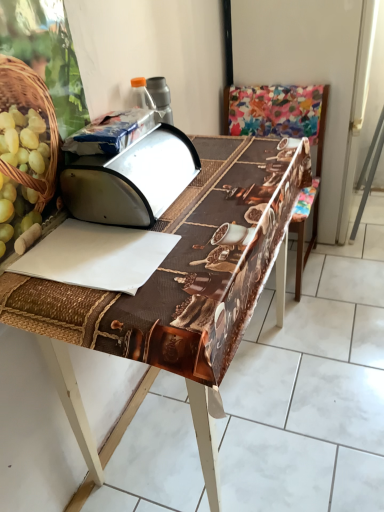
The image size is (384, 512). I want to click on metallic silver breadbox at center, so click(131, 180).

The height and width of the screenshot is (512, 384). What do you see at coordinates (131, 180) in the screenshot?
I see `metallic silver breadbox at center` at bounding box center [131, 180].

Describe the element at coordinates (111, 133) in the screenshot. I see `blue plastic bag at upper center, positioned as the 2th wrapping paper in bottom-to-top order` at that location.

Measure the distance between point (78,145) and camera.

38.39 inches.

The height and width of the screenshot is (512, 384). Describe the element at coordinates (303, 238) in the screenshot. I see `multicolored fabric chair at center` at that location.

Where is `brown woven table at center`? Image resolution: width=384 pixels, height=512 pixels. brown woven table at center is located at coordinates (x=175, y=290).

Where is `metallic silver breadbox at center`? metallic silver breadbox at center is located at coordinates (131, 180).

Is white paper at center, which ranks as the second wrapping paper in top-to-bottom order, shorter than metallic silver breadbox at center?

Indeed, white paper at center, which ranks as the second wrapping paper in top-to-bottom order, has a lesser height compared to metallic silver breadbox at center.

Can you confirm if white paper at center, which ranks as the second wrapping paper in top-to-bottom order, is smaller than metallic silver breadbox at center?

Yes, white paper at center, which ranks as the second wrapping paper in top-to-bottom order, is smaller than metallic silver breadbox at center.

How many degrees apart are the facing directions of white paper at center, the first wrapping paper in the bottom-to-top sequence, and metallic silver breadbox at center?

The angle between the facing direction of white paper at center, the first wrapping paper in the bottom-to-top sequence, and the facing direction of metallic silver breadbox at center is 0.00106 degrees.

Which object is further away from the camera taking this photo, white paper at center, the first wrapping paper in the bottom-to-top sequence, or metallic silver breadbox at center?

Positioned behind is metallic silver breadbox at center.

From the image's perspective, which object appears higher, multicolored fabric chair at center or white paper at center, which ranks as the second wrapping paper in top-to-bottom order?

multicolored fabric chair at center.

Does multicolored fabric chair at center touch white paper at center, which ranks as the second wrapping paper in top-to-bottom order?

multicolored fabric chair at center and white paper at center, which ranks as the second wrapping paper in top-to-bottom order, are clearly separated.

This screenshot has width=384, height=512. I want to click on the 2nd wrapping paper in front when counting from the multicolored fabric chair at center, so click(x=96, y=256).

Considering their positions, is multicolored fabric chair at center located in front of or behind white paper at center, the first wrapping paper in the bottom-to-top sequence?

multicolored fabric chair at center is behind white paper at center, the first wrapping paper in the bottom-to-top sequence.

Is point (138, 112) less distant than point (310, 241)?

That is True.

Is blue plastic bag at upper center, which is the 1th wrapping paper in top-to-bottom order, turned away from multicolored fabric chair at center?

No.

From the image's perspective, between blue plastic bag at upper center, positioned as the 2th wrapping paper in bottom-to-top order, and multicolored fabric chair at center, who is located below?

multicolored fabric chair at center is shown below in the image.

In the scene shown: Is metallic silver breadbox at center in front of blue plastic bag at upper center, positioned as the 2th wrapping paper in bottom-to-top order?

Yes, the depth of metallic silver breadbox at center is less than that of blue plastic bag at upper center, positioned as the 2th wrapping paper in bottom-to-top order.

The image size is (384, 512). I want to click on wide located on the right of blue plastic bag at upper center, positioned as the 2th wrapping paper in bottom-to-top order, so click(x=131, y=180).

Looking at the image, does metallic silver breadbox at center seem bigger or smaller compared to blue plastic bag at upper center, positioned as the 2th wrapping paper in bottom-to-top order?

In the image, metallic silver breadbox at center appears to be larger than blue plastic bag at upper center, positioned as the 2th wrapping paper in bottom-to-top order.

Which is correct: metallic silver breadbox at center is inside blue plastic bag at upper center, which is the 1th wrapping paper in top-to-bottom order, or outside of it?

metallic silver breadbox at center cannot be found inside blue plastic bag at upper center, which is the 1th wrapping paper in top-to-bottom order.

Between multicolored fabric chair at center and metallic silver breadbox at center, which one has smaller size?

metallic silver breadbox at center.

From the picture: Is multicolored fabric chair at center facing away from metallic silver breadbox at center?

That's not correct — multicolored fabric chair at center is not looking away from metallic silver breadbox at center.

How different are the orientations of multicolored fabric chair at center and metallic silver breadbox at center in degrees?

90 degrees.

From a real-world perspective, is multicolored fabric chair at center located higher than metallic silver breadbox at center?

No.

From the image's perspective, between brown woven table at center and white paper at center, the first wrapping paper in the bottom-to-top sequence, who is located below?

brown woven table at center, from the image's perspective.

Does brown woven table at center contain white paper at center, the first wrapping paper in the bottom-to-top sequence?

Yes, white paper at center, the first wrapping paper in the bottom-to-top sequence, is a part of brown woven table at center.

Could you tell me if brown woven table at center is turned towards white paper at center, the first wrapping paper in the bottom-to-top sequence?

No, brown woven table at center is not oriented towards white paper at center, the first wrapping paper in the bottom-to-top sequence.

Looking at this image, is the position of brown woven table at center less distant than that of white paper at center, the first wrapping paper in the bottom-to-top sequence?

Yes, it is.

Could multicolored fabric chair at center be considered to be inside brown woven table at center?

That's incorrect, multicolored fabric chair at center is not inside brown woven table at center.

Is brown woven table at center at the right side of multicolored fabric chair at center?

No.

From a real-world perspective, is brown woven table at center positioned above or below multicolored fabric chair at center?

Clearly, from a real-world perspective, brown woven table at center is below multicolored fabric chair at center.

The image size is (384, 512). I want to click on the 2nd wrapping paper to the left of the metallic silver breadbox at center, starting your count from the anchor, so click(96, 256).

This screenshot has width=384, height=512. In the image, there is a white paper at center, which ranks as the second wrapping paper in top-to-bottom order. In order to click on chair above it (from the image's perspective) in this screenshot , I will do `click(303, 238)`.

Estimate the real-world distances between objects in this image. Which object is closer to metallic silver breadbox at center, multicolored fabric chair at center or white paper at center, which ranks as the second wrapping paper in top-to-bottom order?

white paper at center, which ranks as the second wrapping paper in top-to-bottom order, is positioned closer to the anchor metallic silver breadbox at center.

Based on their spatial positions, is metallic silver breadbox at center or multicolored fabric chair at center closer to blue plastic bag at upper center, positioned as the 2th wrapping paper in bottom-to-top order?

metallic silver breadbox at center lies closer to blue plastic bag at upper center, positioned as the 2th wrapping paper in bottom-to-top order, than the other object.

Considering their positions, is multicolored fabric chair at center positioned further to white paper at center, the first wrapping paper in the bottom-to-top sequence, than blue plastic bag at upper center, positioned as the 2th wrapping paper in bottom-to-top order?

multicolored fabric chair at center.

Estimate the real-world distances between objects in this image. Which object is further from metallic silver breadbox at center, brown woven table at center or blue plastic bag at upper center, which is the 1th wrapping paper in top-to-bottom order?

The object further to metallic silver breadbox at center is brown woven table at center.

Considering their positions, is multicolored fabric chair at center positioned closer to blue plastic bag at upper center, positioned as the 2th wrapping paper in bottom-to-top order, than brown woven table at center?

brown woven table at center is positioned closer to the anchor blue plastic bag at upper center, positioned as the 2th wrapping paper in bottom-to-top order.

From the image, which object appears to be nearer to blue plastic bag at upper center, which is the 1th wrapping paper in top-to-bottom order, brown woven table at center or multicolored fabric chair at center?

Among the two, brown woven table at center is located nearer to blue plastic bag at upper center, which is the 1th wrapping paper in top-to-bottom order.

Which object lies further to the anchor point metallic silver breadbox at center, brown woven table at center or multicolored fabric chair at center?

The object further to metallic silver breadbox at center is multicolored fabric chair at center.

Based on their spatial positions, is white paper at center, the first wrapping paper in the bottom-to-top sequence, or brown woven table at center further from multicolored fabric chair at center?

white paper at center, the first wrapping paper in the bottom-to-top sequence, lies further to multicolored fabric chair at center than the other object.

Where is `wide positioned between white paper at center, which ranks as the second wrapping paper in top-to-bottom order, and multicolored fabric chair at center from near to far`? Image resolution: width=384 pixels, height=512 pixels. wide positioned between white paper at center, which ranks as the second wrapping paper in top-to-bottom order, and multicolored fabric chair at center from near to far is located at coordinates (131, 180).

You are a GUI agent. You are given a task and a screenshot of the screen. Output one action in this format:
    pyautogui.click(x=<x>, y=<y>)
    Task: Click on the wrapping paper between white paper at center, the first wrapping paper in the bottom-to-top sequence, and multicolored fabric chair at center, along the z-axis
    
    Given the screenshot: What is the action you would take?
    pyautogui.click(x=111, y=133)

You are a GUI agent. You are given a task and a screenshot of the screen. Output one action in this format:
    pyautogui.click(x=<x>, y=<y>)
    Task: Click on the wide between blue plastic bag at upper center, positioned as the 2th wrapping paper in bottom-to-top order, and brown woven table at center in the up-down direction
    Image resolution: width=384 pixels, height=512 pixels.
    Given the screenshot: What is the action you would take?
    pyautogui.click(x=131, y=180)

Identify the location of wrapping paper that lies between metallic silver breadbox at center and brown woven table at center from top to bottom. (96, 256).